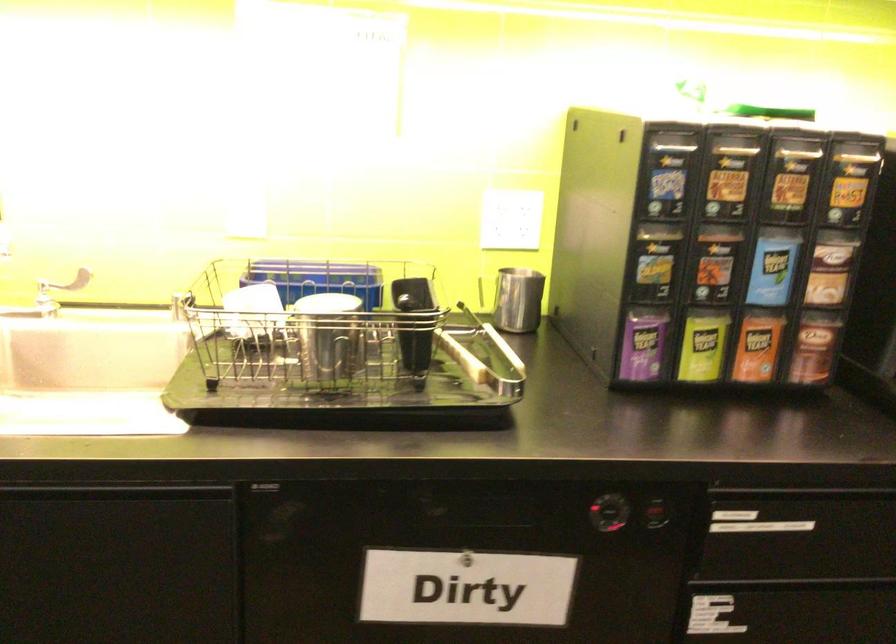
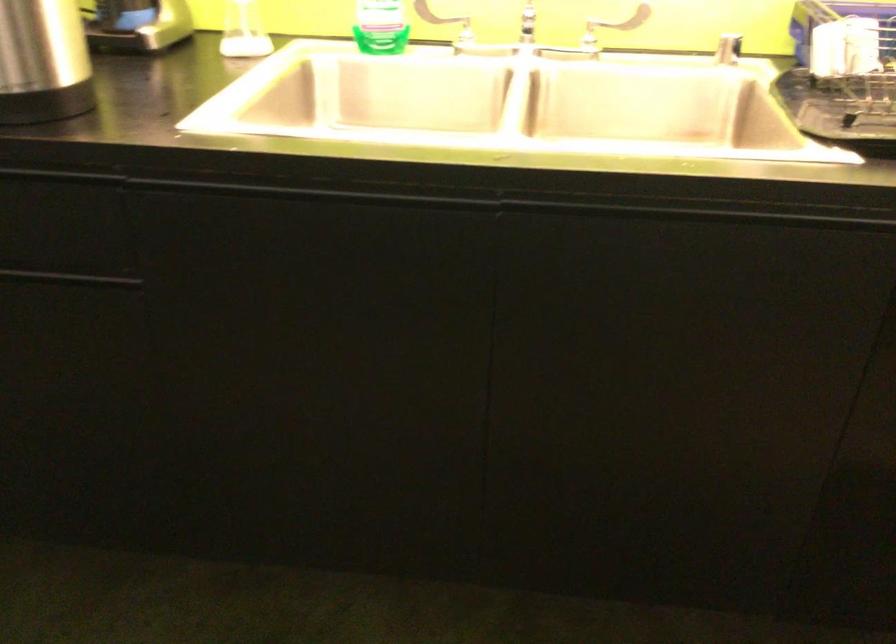
Question: Based on the continuous images, in which direction is the camera rotating? Reply with the corresponding letter.

Choices:
 (A) Left
 (B) Right
 (C) Up
 (D) Down

Answer: (A)